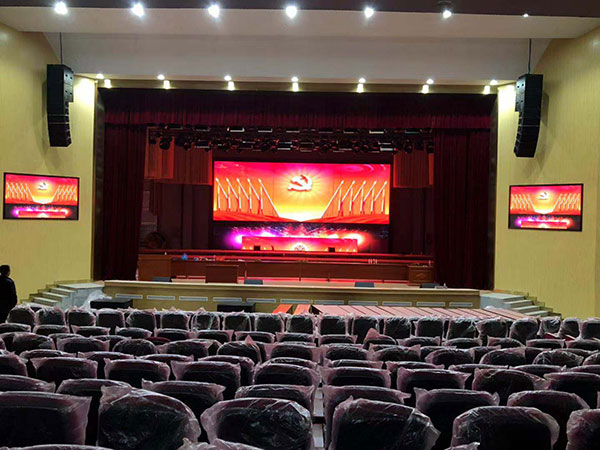
You are a GUI agent. You are given a task and a screenshot of the screen. Output one action in this format:
    pyautogui.click(x=<x>, y=<y>)
    Task: Click on the stage
    The width and height of the screenshot is (600, 450).
    Given the screenshot: What is the action you would take?
    pyautogui.click(x=294, y=291)